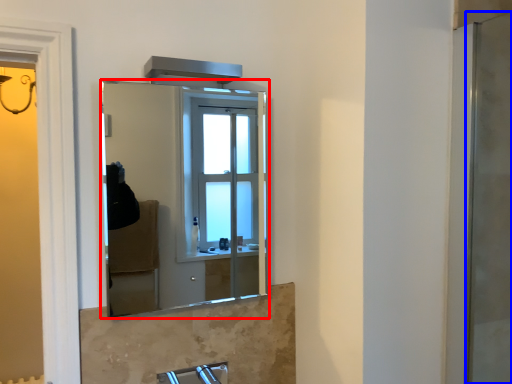
Question: Which of the following is the closest to the observer, mirror (highlighted by a red box) or screen door (highlighted by a blue box)?

Choices:
 (A) mirror
 (B) screen door

Answer: (B)